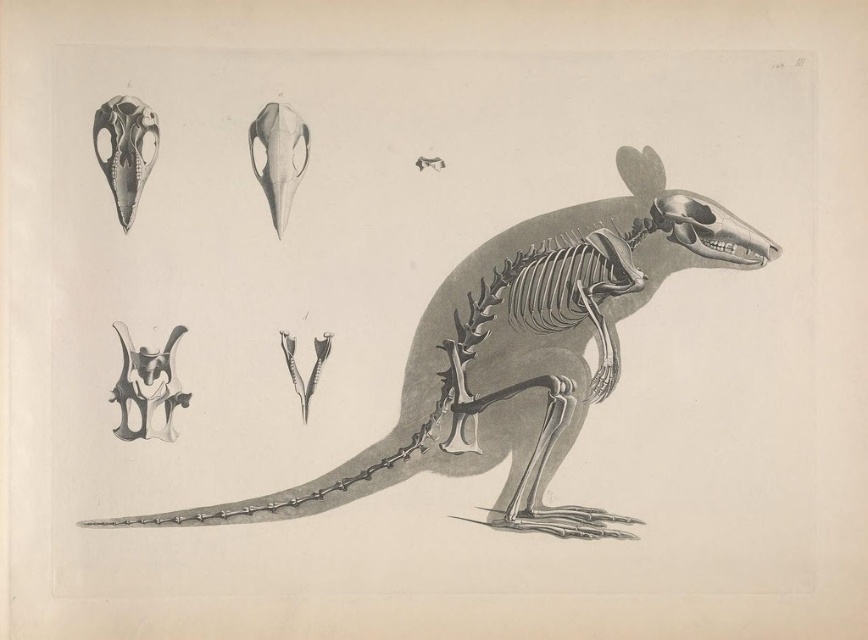
You are standing in front of an anatomical illustration of a marsupial skeleton. There is a point labeled at coordinates point (150,134). If you were to walk towards the illustration, would this point appear closer to you compared to other parts of the skeleton?

The point (150,134) is 2.41 meters away from the viewer, so it would appear at the same distance as other parts of the skeleton since they are all part of the same illustration displayed on a flat surface.

In the anatomical illustration of the marsupial skeleton, there is a point labeled at coordinates (x=125, y=150). Which specific skeletal component does this point correspond to?

The point at (x=125, y=150) is located on the matte black skull at upper left.

Based on the photo, you are observing an anatomical illustration of a marsupial skeleton. The illustration includes a main skeleton and several smaller components. There is a point labeled at coordinates point (720, 234). Considering the spatial arrangement of the illustration, where is this point located relative to the main skeleton?

The point labeled at coordinates point (720, 234) is 7.98 feet away from the viewer, meaning it is positioned in front of the main skeleton since it is closer to the viewer than the main structure.